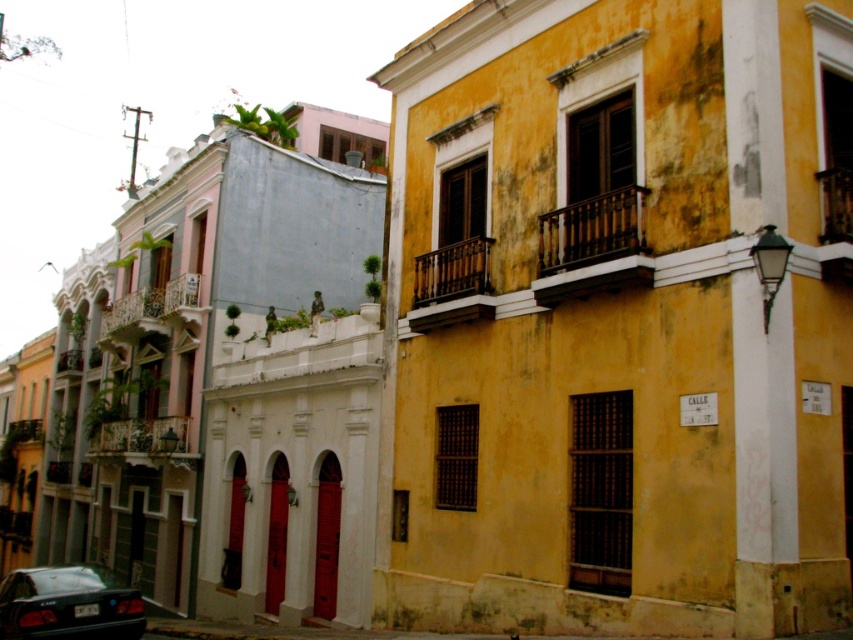
You are standing at the point with coordinates (67, 605) in the image. What object is located exactly at that point?

The shiny black sedan at lower left is located exactly at point (67, 605).

You are a delivery driver who needs to park your 15 feet long shiny black sedan at lower left near the wooden at upper center. Can you park it there without blocking the entrance of the building?

The wooden at upper center and shiny black sedan at lower left are 48.00 feet apart. Since the sedan is only 15 feet long, there is enough space between them to park without blocking the entrance.